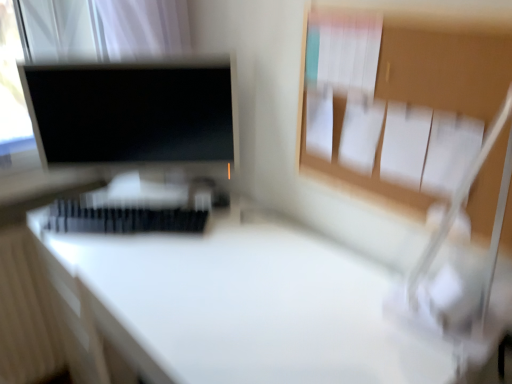
Question: Is white glossy desk at center at the right side of white plastic keyboard at center?

Choices:
 (A) no
 (B) yes

Answer: (B)

Question: Is white glossy desk at center wider than white plastic keyboard at center?

Choices:
 (A) yes
 (B) no

Answer: (A)

Question: From a real-world perspective, does white glossy desk at center sit lower than white plastic keyboard at center?

Choices:
 (A) yes
 (B) no

Answer: (A)

Question: Are white glossy desk at center and white plastic keyboard at center beside each other?

Choices:
 (A) yes
 (B) no

Answer: (B)

Question: From a real-world perspective, is white glossy desk at center on top of white plastic keyboard at center?

Choices:
 (A) no
 (B) yes

Answer: (A)

Question: In terms of height, does white plastic keyboard at center look taller or shorter compared to matte black monitor at upper left?

Choices:
 (A) tall
 (B) short

Answer: (B)

Question: Is white plastic keyboard at center situated inside matte black monitor at upper left or outside?

Choices:
 (A) inside
 (B) outside

Answer: (B)

Question: From a real-world perspective, is white plastic keyboard at center physically located above or below matte black monitor at upper left?

Choices:
 (A) above
 (B) below

Answer: (B)

Question: Considering the positions of point (193, 215) and point (32, 66), is point (193, 215) closer or farther from the camera than point (32, 66)?

Choices:
 (A) closer
 (B) farther

Answer: (A)

Question: Is matte black monitor at upper left in front of or behind white plastic keyboard at center in the image?

Choices:
 (A) behind
 (B) front

Answer: (A)

Question: Would you say matte black monitor at upper left is to the left or to the right of white plastic keyboard at center in the picture?

Choices:
 (A) right
 (B) left

Answer: (A)

Question: From a real-world perspective, relative to white plastic keyboard at center, is matte black monitor at upper left vertically above or below?

Choices:
 (A) below
 (B) above

Answer: (B)

Question: Looking at their shapes, would you say matte black monitor at upper left is wider or thinner than white plastic keyboard at center?

Choices:
 (A) thin
 (B) wide

Answer: (B)

Question: Would you say white glossy desk at center is to the left or to the right of matte black monitor at upper left in the picture?

Choices:
 (A) right
 (B) left

Answer: (A)

Question: In the image, is white glossy desk at center positioned in front of or behind matte black monitor at upper left?

Choices:
 (A) front
 (B) behind

Answer: (A)